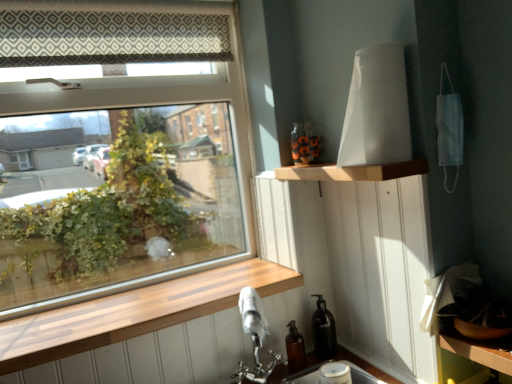
Question: From the image's perspective, is transparent glass window at upper left over wooden shelf at upper center?

Choices:
 (A) yes
 (B) no

Answer: (A)

Question: Would you say transparent glass window at upper left is a long distance from wooden shelf at upper center?

Choices:
 (A) yes
 (B) no

Answer: (A)

Question: From the image's perspective, is transparent glass window at upper left located beneath wooden shelf at upper center?

Choices:
 (A) no
 (B) yes

Answer: (A)

Question: Is transparent glass window at upper left at the right side of wooden shelf at upper center?

Choices:
 (A) yes
 (B) no

Answer: (B)

Question: Is transparent glass window at upper left shorter than wooden shelf at upper center?

Choices:
 (A) no
 (B) yes

Answer: (A)

Question: Is wooden shelf at upper center inside or outside of transparent glass window at upper left?

Choices:
 (A) inside
 (B) outside

Answer: (B)

Question: Considering the positions of wooden shelf at upper center and transparent glass window at upper left in the image, is wooden shelf at upper center wider or thinner than transparent glass window at upper left?

Choices:
 (A) wide
 (B) thin

Answer: (A)

Question: Based on their positions, is wooden shelf at upper center located to the left or right of transparent glass window at upper left?

Choices:
 (A) right
 (B) left

Answer: (A)

Question: In terms of size, does wooden shelf at upper center appear bigger or smaller than transparent glass window at upper left?

Choices:
 (A) big
 (B) small

Answer: (B)

Question: From the image's perspective, relative to wooden shelf at upper center, is transparent glass window at upper left above or below?

Choices:
 (A) below
 (B) above

Answer: (B)

Question: Considering the positions of transparent glass window at upper left and wooden shelf at upper center in the image, is transparent glass window at upper left wider or thinner than wooden shelf at upper center?

Choices:
 (A) wide
 (B) thin

Answer: (B)

Question: Is transparent glass window at upper left to the left or to the right of wooden shelf at upper center in the image?

Choices:
 (A) right
 (B) left

Answer: (B)

Question: Considering the positions of point (161, 236) and point (293, 165), is point (161, 236) closer or farther from the camera than point (293, 165)?

Choices:
 (A) farther
 (B) closer

Answer: (A)

Question: Would you say wooden shelf at upper center is inside or outside wooden at lower left?

Choices:
 (A) inside
 (B) outside

Answer: (B)

Question: Is wooden shelf at upper center wider or thinner than wooden at lower left?

Choices:
 (A) wide
 (B) thin

Answer: (B)